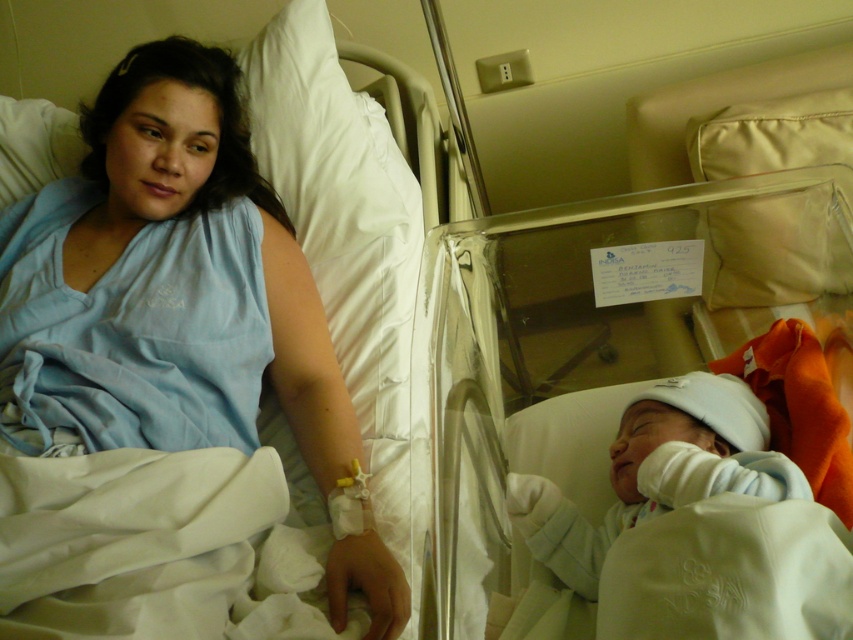
Consider the image. Between blue fabric at upper left and white soft newborn at center, which one has less height?

white soft newborn at center

Who is more distant from viewer, (128, 385) or (664, 403)?

The point (128, 385) is more distant.

You are a GUI agent. You are given a task and a screenshot of the screen. Output one action in this format:
    pyautogui.click(x=<x>, y=<y>)
    Task: Click on the blue fabric at upper left
    Image resolution: width=853 pixels, height=640 pixels.
    Given the screenshot: What is the action you would take?
    pyautogui.click(x=178, y=305)